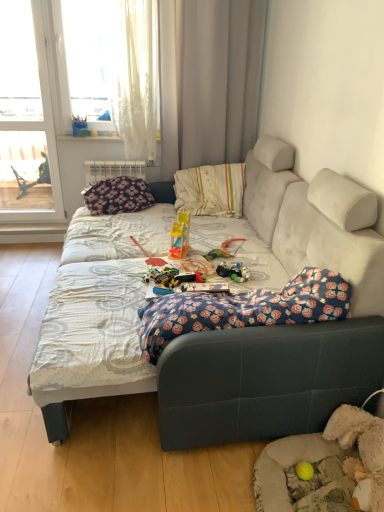
The height and width of the screenshot is (512, 384). What do you see at coordinates (244, 309) in the screenshot?
I see `floral fabric blanket at center` at bounding box center [244, 309].

You are a GUI agent. You are given a task and a screenshot of the screen. Output one action in this format:
    pyautogui.click(x=<x>, y=<y>)
    Task: Click on the velvet gray couch at center
    The height and width of the screenshot is (512, 384).
    Given the screenshot: What is the action you would take?
    point(229,333)

The width and height of the screenshot is (384, 512). Describe the element at coordinates (229, 333) in the screenshot. I see `velvet gray couch at center` at that location.

What do you see at coordinates (26, 119) in the screenshot? I see `transparent glass window at left, placed as the 1th window when sorted from left to right` at bounding box center [26, 119].

At what (x,y) coordinates should I click in order to perform the action: click on translucent plastic slide at center, acting as the first toy starting from the left. Please return your answer as a coordinate pair (x, y). Looking at the image, I should click on (180, 234).

Locate an element on the screen. The image size is (384, 512). white sheer curtain at upper left, which ranks as the second window in left-to-right order is located at coordinates (91, 60).

Is transparent glass window at left, the second window when ordered from right to left, shorter than yellow rubber ball at lower right, which is the 1th toy from bottom to top?

Incorrect, the height of transparent glass window at left, the second window when ordered from right to left, does not fall short of that of yellow rubber ball at lower right, which is the 1th toy from bottom to top.

Considering the relative sizes of transparent glass window at left, the second window when ordered from right to left, and yellow rubber ball at lower right, placed as the second toy when sorted from back to front, in the image provided, is transparent glass window at left, the second window when ordered from right to left, bigger than yellow rubber ball at lower right, placed as the second toy when sorted from back to front,?

Indeed, transparent glass window at left, the second window when ordered from right to left, has a larger size compared to yellow rubber ball at lower right, placed as the second toy when sorted from back to front.

Is transparent glass window at left, the second window when ordered from right to left, completely or partially outside of yellow rubber ball at lower right, marked as the first toy in a right-to-left arrangement?

Indeed, transparent glass window at left, the second window when ordered from right to left, is completely outside yellow rubber ball at lower right, marked as the first toy in a right-to-left arrangement.

At what (x,y) coordinates should I click in order to perform the action: click on toy that is the 2nd object located below the transparent glass window at left, the second window when ordered from right to left (from the image's perspective). Please return your answer as a coordinate pair (x, y). Looking at the image, I should click on (304, 471).

Which of these two, velvet gray couch at center or translucent plastic slide at center, which is counted as the second toy, starting from the front, stands taller?

With more height is velvet gray couch at center.

Does point (66, 267) come in front of point (187, 251)?

Yes.

Can you tell me how much velvet gray couch at center and translucent plastic slide at center, acting as the first toy starting from the left, differ in facing direction?

17.5 degrees separate the facing orientations of velvet gray couch at center and translucent plastic slide at center, acting as the first toy starting from the left.

Is velvet gray couch at center in front of translucent plastic slide at center, placed as the 2th toy when sorted from right to left?

Yes, it is.

Who is taller, white fabric curtain at upper center or velvet gray couch at center?

With more height is white fabric curtain at upper center.

Looking at their sizes, would you say white fabric curtain at upper center is wider or thinner than velvet gray couch at center?

Clearly, white fabric curtain at upper center has less width compared to velvet gray couch at center.

Is white fabric curtain at upper center to the right of velvet gray couch at center from the viewer's perspective?

Yes.

Can you see white fabric curtain at upper center touching velvet gray couch at center?

No, white fabric curtain at upper center is not touching velvet gray couch at center.

From the image's perspective, which is above, white sheer curtain at upper left, which appears as the 1th window when viewed from the right, or transparent glass window at left, placed as the 1th window when sorted from left to right?

From the image's view, white sheer curtain at upper left, which appears as the 1th window when viewed from the right, is above.

In the scene shown: Can you tell me how much white sheer curtain at upper left, which appears as the 1th window when viewed from the right, and transparent glass window at left, the second window when ordered from right to left, differ in facing direction?

The angular difference between white sheer curtain at upper left, which appears as the 1th window when viewed from the right, and transparent glass window at left, the second window when ordered from right to left, is 0.433 degrees.

Relative to transparent glass window at left, placed as the 1th window when sorted from left to right, is white sheer curtain at upper left, which appears as the 1th window when viewed from the right, in front or behind?

Clearly, white sheer curtain at upper left, which appears as the 1th window when viewed from the right, is in front of transparent glass window at left, placed as the 1th window when sorted from left to right.

In terms of height, does white sheer curtain at upper left, which appears as the 1th window when viewed from the right, look taller or shorter compared to transparent glass window at left, placed as the 1th window when sorted from left to right?

Clearly, white sheer curtain at upper left, which appears as the 1th window when viewed from the right, is shorter compared to transparent glass window at left, placed as the 1th window when sorted from left to right.

Do you think translucent plastic slide at center, the 1th toy when ordered from back to front, is within yellow rubber ball at lower right, placed as the second toy when sorted from back to front, or outside of it?

translucent plastic slide at center, the 1th toy when ordered from back to front, is not enclosed by yellow rubber ball at lower right, placed as the second toy when sorted from back to front.

From a real-world perspective, is translucent plastic slide at center, acting as the first toy starting from the top, under yellow rubber ball at lower right, which is the 1th toy from bottom to top?

No, from a real-world perspective, translucent plastic slide at center, acting as the first toy starting from the top, is not below yellow rubber ball at lower right, which is the 1th toy from bottom to top.

Considering the sizes of translucent plastic slide at center, which is counted as the second toy, starting from the front, and yellow rubber ball at lower right, placed as the second toy when sorted from back to front, in the image, is translucent plastic slide at center, which is counted as the second toy, starting from the front, wider or thinner than yellow rubber ball at lower right, placed as the second toy when sorted from back to front,?

Clearly, translucent plastic slide at center, which is counted as the second toy, starting from the front, has more width compared to yellow rubber ball at lower right, placed as the second toy when sorted from back to front.

Which of these two, translucent plastic slide at center, acting as the first toy starting from the left, or yellow rubber ball at lower right, the second toy when ordered from left to right, is bigger?

translucent plastic slide at center, acting as the first toy starting from the left.

Is velvet gray couch at center facing away from white fabric curtain at upper center?

That's not correct — velvet gray couch at center is not looking away from white fabric curtain at upper center.

Between velvet gray couch at center and white fabric curtain at upper center, which one has larger size?

Bigger between the two is velvet gray couch at center.

Is white fabric curtain at upper center surrounded by velvet gray couch at center?

Definitely not — white fabric curtain at upper center is not inside velvet gray couch at center.

Is white sheer curtain at upper left, which appears as the 1th window when viewed from the right, in front of or behind translucent plastic slide at center, the second toy ordered from the bottom, in the image?

white sheer curtain at upper left, which appears as the 1th window when viewed from the right, is positioned farther from the viewer than translucent plastic slide at center, the second toy ordered from the bottom.

Is white sheer curtain at upper left, which ranks as the second window in left-to-right order, smaller than translucent plastic slide at center, placed as the 2th toy when sorted from right to left?

Actually, white sheer curtain at upper left, which ranks as the second window in left-to-right order, might be larger than translucent plastic slide at center, placed as the 2th toy when sorted from right to left.

Does white sheer curtain at upper left, which ranks as the second window in left-to-right order, have a lesser height compared to translucent plastic slide at center, the second toy ordered from the bottom?

No, white sheer curtain at upper left, which ranks as the second window in left-to-right order, is not shorter than translucent plastic slide at center, the second toy ordered from the bottom.

The image size is (384, 512). In order to click on the 2nd window counting from the left of the yellow rubber ball at lower right, which appears as the second toy when viewed from the top in this screenshot , I will do `click(26, 119)`.

Starting from the velvet gray couch at center, which toy is the 2nd one behind? Please provide its 2D coordinates.

[(180, 234)]

Which object lies further to the anchor point translucent plastic slide at center, the 1th toy when ordered from back to front, transparent glass window at left, placed as the 1th window when sorted from left to right, or translucent plastic toy at center?

transparent glass window at left, placed as the 1th window when sorted from left to right, is positioned further to the anchor translucent plastic slide at center, the 1th toy when ordered from back to front.

When comparing their distances from velvet gray couch at center, does white sheer curtain at upper left, which appears as the 1th window when viewed from the right, or white fabric curtain at upper center seem further?

white sheer curtain at upper left, which appears as the 1th window when viewed from the right.

In the scene shown: Considering their positions, is transparent glass window at left, the second window when ordered from right to left, positioned closer to white fabric curtain at upper center than velvet gray couch at center?

transparent glass window at left, the second window when ordered from right to left, is positioned closer to the anchor white fabric curtain at upper center.

Looking at the image, which one is located further to fluffy beige dog bed at lower right, translucent plastic toy at center or translucent plastic slide at center, the second toy ordered from the bottom?

Based on the image, translucent plastic slide at center, the second toy ordered from the bottom, appears to be further to fluffy beige dog bed at lower right.

Considering their positions, is yellow rubber ball at lower right, which is the 1th toy from bottom to top, positioned closer to white fabric curtain at upper center than fluffy beige dog bed at lower right?

The object closer to white fabric curtain at upper center is fluffy beige dog bed at lower right.

Which object lies nearer to the anchor point translucent plastic slide at center, the 1th toy when ordered from back to front, velvet gray couch at center or white sheer curtain at upper left, which ranks as the second window in left-to-right order?

velvet gray couch at center.

Consider the image. Considering their positions, is fluffy beige dog bed at lower right positioned closer to floral fabric blanket at center than yellow rubber ball at lower right, which is the 1th toy from bottom to top?

fluffy beige dog bed at lower right.

Based on their spatial positions, is white fabric curtain at upper center or translucent plastic slide at center, acting as the first toy starting from the left, further from floral fabric blanket at center?

white fabric curtain at upper center.

I want to click on blanket between translucent plastic slide at center, placed as the 2th toy when sorted from right to left, and yellow rubber ball at lower right, marked as the first toy in a right-to-left arrangement, vertically, so click(244, 309).

Identify the location of miniature that lies between white sheer curtain at upper left, which ranks as the second window in left-to-right order, and fluffy beige dog bed at lower right from top to bottom. Image resolution: width=384 pixels, height=512 pixels. (234, 272).

You are a GUI agent. You are given a task and a screenshot of the screen. Output one action in this format:
    pyautogui.click(x=<x>, y=<y>)
    Task: Click on the blanket between white sheer curtain at upper left, which appears as the 1th window when viewed from the right, and fluffy beige dog bed at lower right vertically
    The height and width of the screenshot is (512, 384).
    Given the screenshot: What is the action you would take?
    pyautogui.click(x=244, y=309)

Identify the location of window between transparent glass window at left, placed as the 1th window when sorted from left to right, and translucent plastic slide at center, acting as the first toy starting from the left, in the horizontal direction. (91, 60).